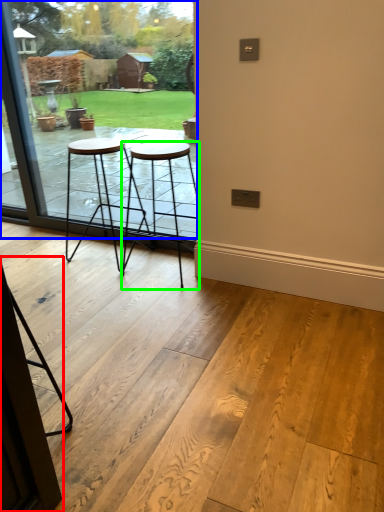
Question: Which object is positioned closest to screen door (highlighted by a red box)? Select from window (highlighted by a blue box) and stool (highlighted by a green box).

Choices:
 (A) window
 (B) stool

Answer: (B)